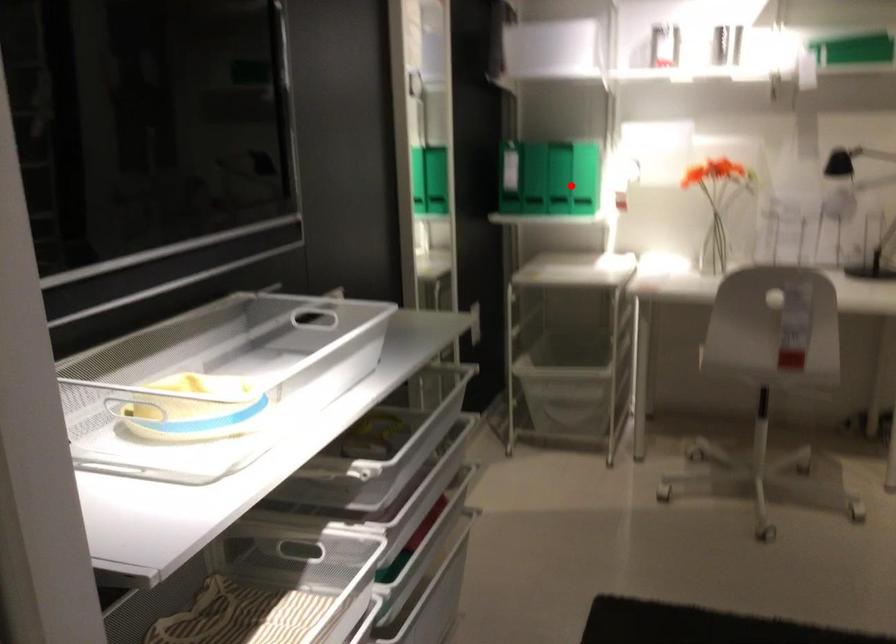
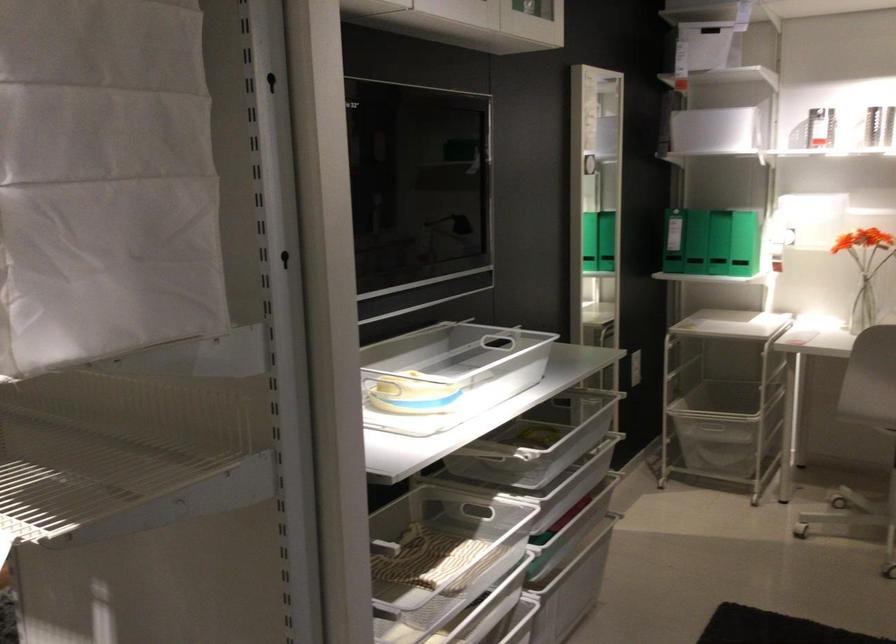
Locate, in the second image, the point that corresponds to the highlighted location in the first image.

(745, 243)